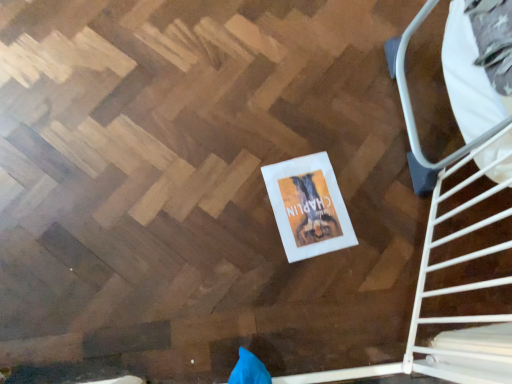
Describe the element at coordinates (466, 181) in the screenshot. This screenshot has height=384, width=512. I see `white metal gate at upper right` at that location.

I want to click on white metal gate at upper right, so click(466, 181).

In order to click on white metal gate at upper right in this screenshot , I will do `click(466, 181)`.